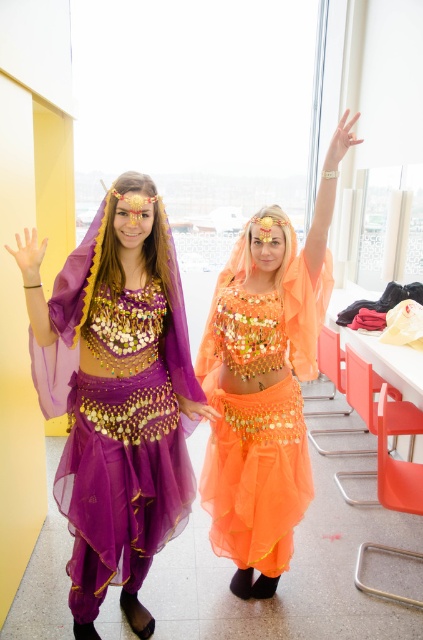
Which is above, matte purple fabric at left or orange sheer fabric belly dancer at center?

orange sheer fabric belly dancer at center

Does matte purple fabric at left appear over orange sheer fabric belly dancer at center?

No.

Is point (170, 316) positioned before point (246, 442)?

Yes.

At what (x,y) coordinates should I click in order to perform the action: click on matte purple fabric at left. Please return your answer as a coordinate pair (x, y). This screenshot has width=423, height=640. Looking at the image, I should click on (118, 396).